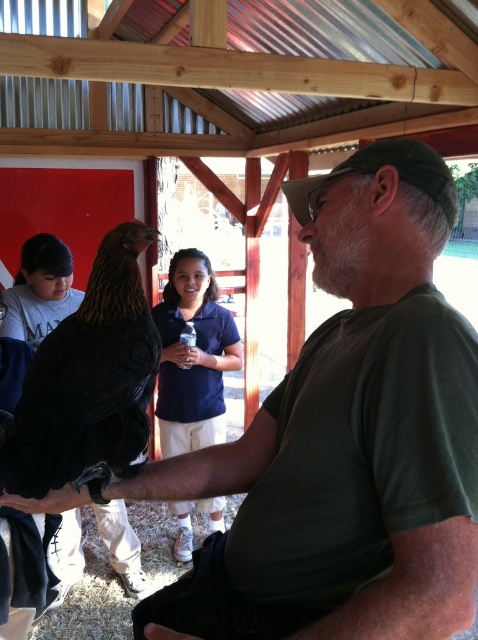
Question: In this image, where is black feathered chicken at center located relative to dark blue shirt at center?

Choices:
 (A) below
 (B) above

Answer: (B)

Question: Does black feathered chicken at center appear on the right side of dark blue shirt at center?

Choices:
 (A) no
 (B) yes

Answer: (A)

Question: Considering the relative positions of black feathered chicken at center and dark blue shirt at center in the image provided, where is black feathered chicken at center located with respect to dark blue shirt at center?

Choices:
 (A) left
 (B) right

Answer: (A)

Question: Which point is closer to the camera?

Choices:
 (A) (214, 280)
 (B) (136, 252)

Answer: (B)